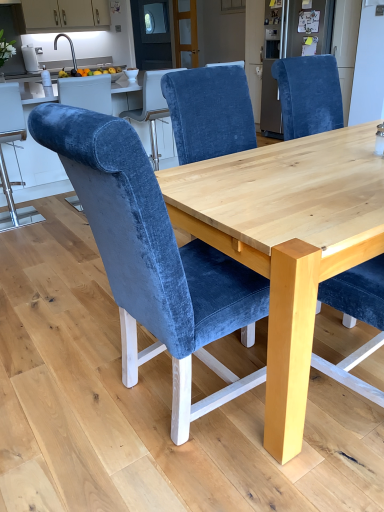
Image resolution: width=384 pixels, height=512 pixels. Identify the location of free point to the left of velvet blue chair at center, which is counted as the first chair, starting from the front. (60, 396).